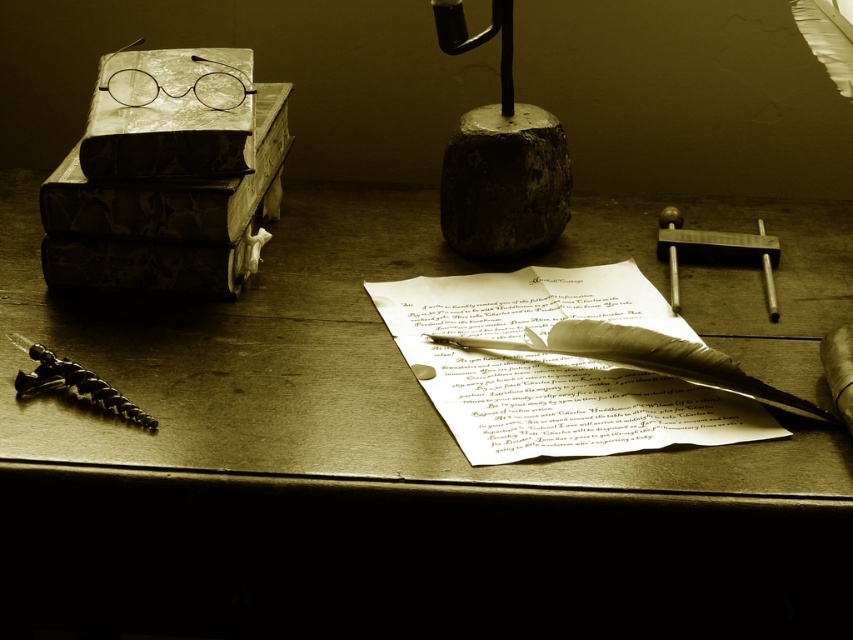
Is point (407, 317) less distant than point (473, 188)?

Yes, it is in front of point (473, 188).

How much distance is there between white parchment paper at center and dark gray stone at center?

7.35 inches

Find the location of a particular element. The image size is (853, 640). white parchment paper at center is located at coordinates (554, 365).

Does wooden desk at center appear under white parchment paper at center?

Correct, wooden desk at center is located below white parchment paper at center.

Does wooden desk at center appear on the left side of white parchment paper at center?

Correct, you'll find wooden desk at center to the left of white parchment paper at center.

What are the coordinates of `wooden desk at center` in the screenshot? It's located at (364, 472).

Is wooden desk at center bigger than dark gray stone at center?

Yes.

Does wooden desk at center come behind dark gray stone at center?

No, wooden desk at center is closer to the viewer.

Who is more distant from viewer, (62,403) or (480,163)?

The point (480,163) is behind.

Find the location of a particular element. This screenshot has height=640, width=853. wooden desk at center is located at coordinates (364, 472).